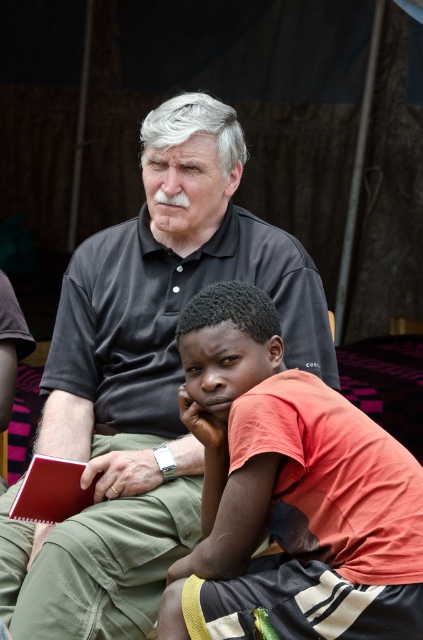
You are a photographer trying to capture a candid shot of both the black matte shirt at center and the orange cotton shirt at center. Since you want to ensure both are visible, which shirt should you focus on first to make sure the focus is sharp?

The black matte shirt at center is above the orange cotton shirt at center, so you should focus on the black matte shirt at center first to ensure both are in sharp focus.

You are a clothing designer observing two people in an image. You need to determine which shirt, the black matte shirt at center or the orange cotton shirt at center, requires more fabric to produce based on their sizes. Which one would you choose?

The black matte shirt at center is bigger than the orange cotton shirt at center, so it requires more fabric to produce.